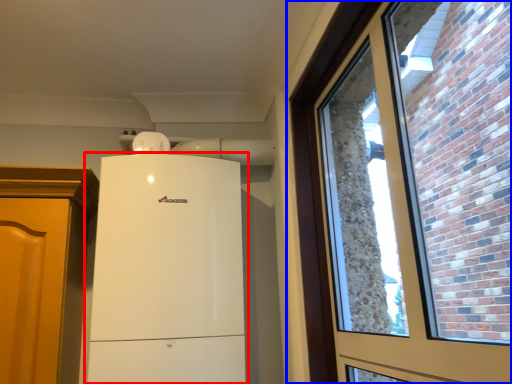
Question: Which object appears farthest to the camera in this image, refrigerator (highlighted by a red box) or window (highlighted by a blue box)?

Choices:
 (A) refrigerator
 (B) window

Answer: (A)